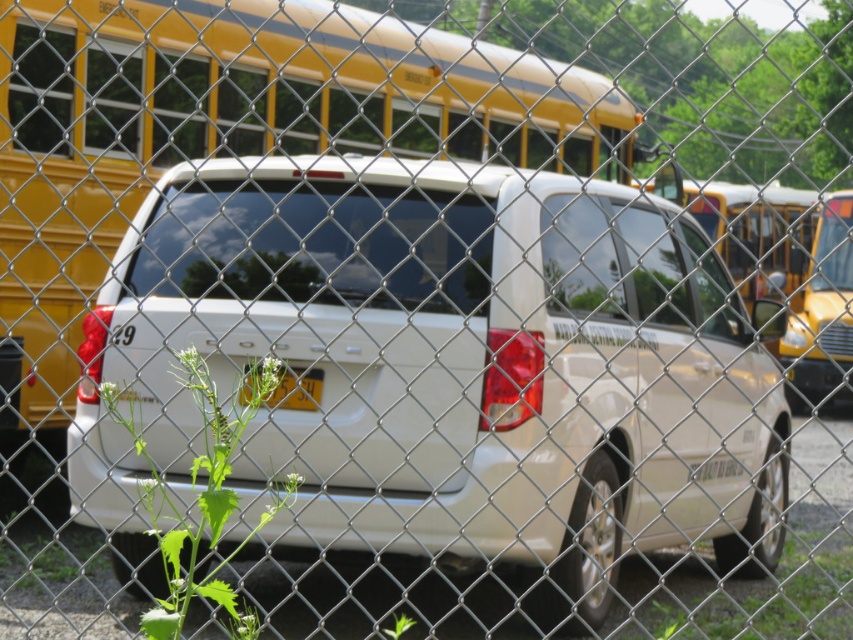
You are standing in front of a chain link fence and want to see the white matte van at center. Where should you look relative to the point at coordinates (442, 372)?

The white matte van at center is located exactly at the point with coordinates (442, 372), so you should look directly at that point to see it.